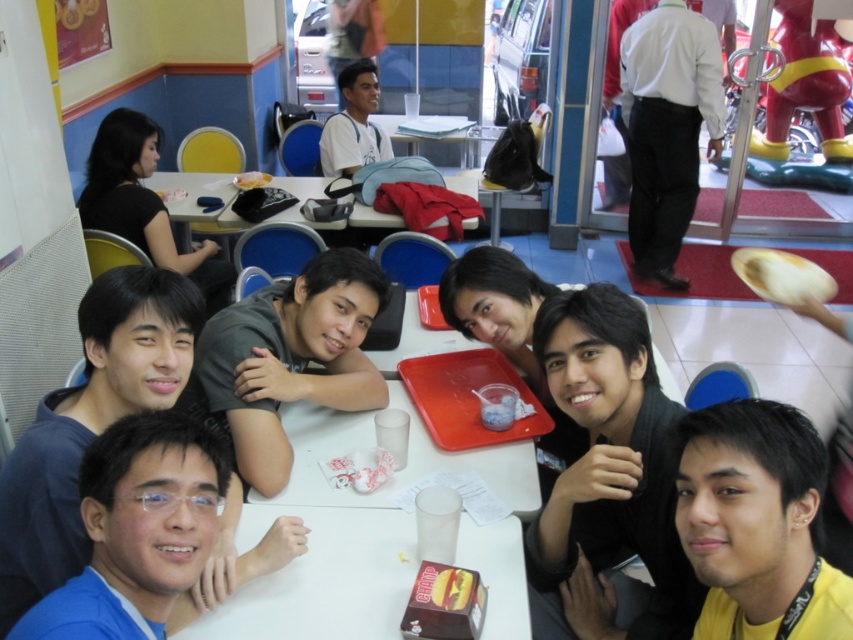
Who is taller, matte plastic table at center or matte gray shirt at center?

matte gray shirt at center

Describe the element at coordinates (196, 195) in the screenshot. I see `matte plastic table at center` at that location.

Where is `matte plastic table at center`? This screenshot has width=853, height=640. matte plastic table at center is located at coordinates (196, 195).

Does black matte shirt at upper left appear on the left side of yellow matte hot dog at center?

Correct, you'll find black matte shirt at upper left to the left of yellow matte hot dog at center.

Which is in front, point (90, 154) or point (450, 579)?

Point (450, 579)

The height and width of the screenshot is (640, 853). Identify the location of black matte shirt at upper left. (144, 204).

Which is more to the left, blue matte shirt at lower left or matte black phone at upper center?

From the viewer's perspective, matte black phone at upper center appears more on the left side.

Is the position of blue matte shirt at lower left less distant than that of matte black phone at upper center?

That is True.

Describe the element at coordinates (141, 506) in the screenshot. I see `blue matte shirt at lower left` at that location.

The image size is (853, 640). I want to click on blue matte shirt at lower left, so [x=141, y=506].